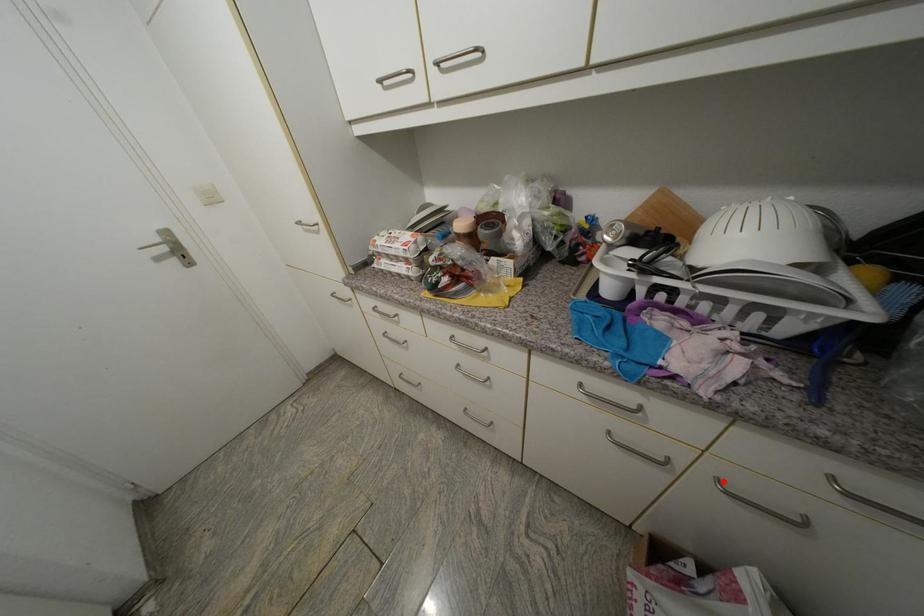
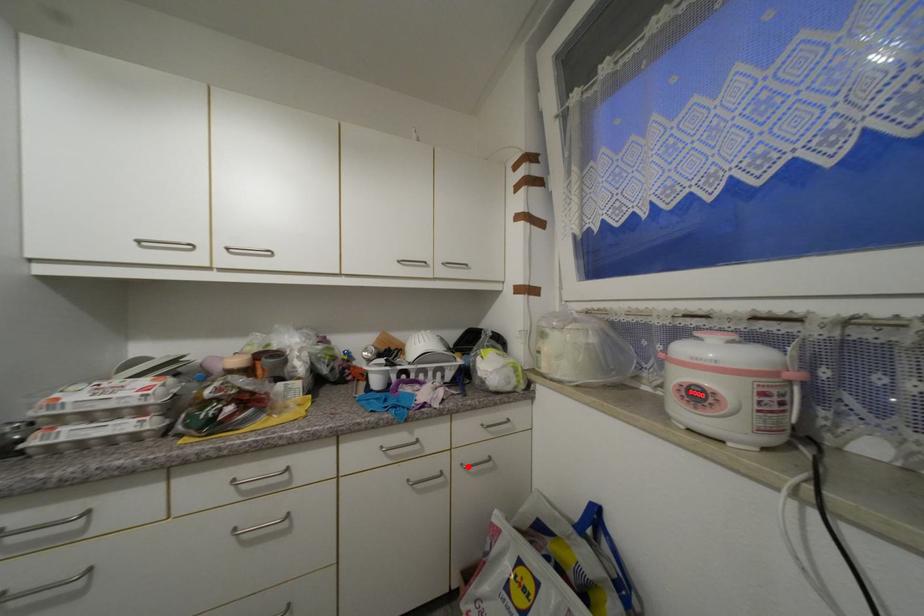
I am providing you with two images of the same scene from different viewpoints. A red point is marked on the first image and another point is marked on the second image. Is the red point in image1 aligned with the point shown in image2?

Yes